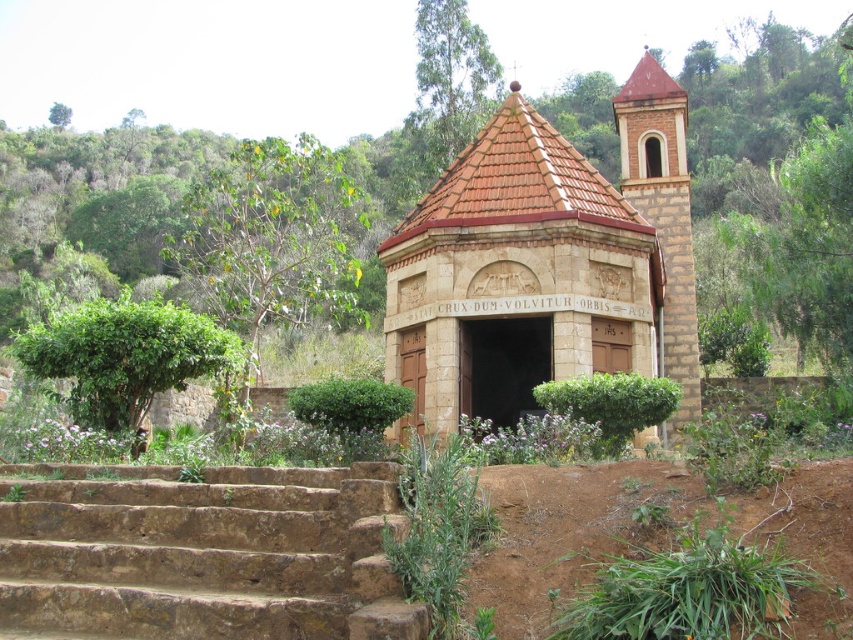
Question: Does brown stone church at center lie behind green leafy tree at upper left?

Choices:
 (A) yes
 (B) no

Answer: (B)

Question: Does green leafy tree at left have a larger size compared to green leafy tree at upper left?

Choices:
 (A) yes
 (B) no

Answer: (A)

Question: Estimate the real-world distances between objects in this image. Which object is closer to the green leafy bush at left?

Choices:
 (A) green leafy tree at left
 (B) green leafy tree at upper left
 (C) brown stone church at center

Answer: (C)

Question: Is green leafy tree at left bigger than green leafy tree at upper center?

Choices:
 (A) yes
 (B) no

Answer: (A)

Question: Which point is closer to the camera taking this photo?

Choices:
 (A) (485, 64)
 (B) (202, 316)
 (C) (244, 192)
 (D) (50, 116)

Answer: (B)

Question: Among these points, which one is farthest from the camera?

Choices:
 (A) [x=281, y=259]
 (B) [x=445, y=324]

Answer: (A)